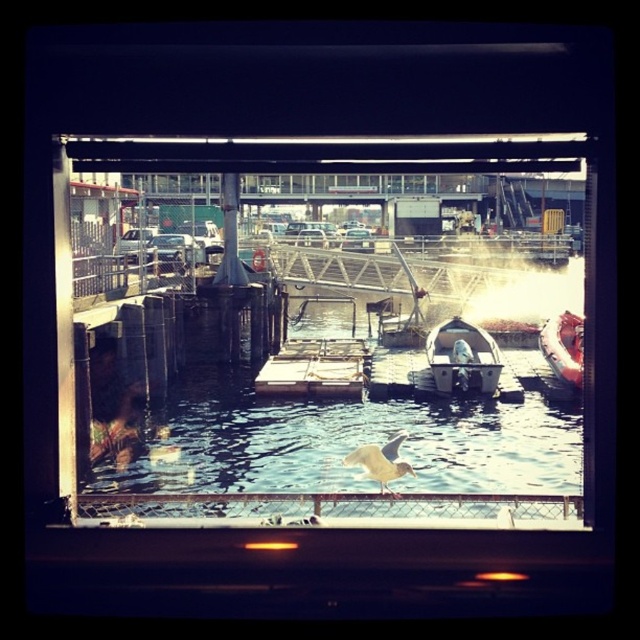
Between transparent glass window at center and white plastic boat at center, which one has less height?

white plastic boat at center is shorter.

Looking at this image, can you confirm if transparent glass window at center is bigger than white plastic boat at center?

Yes.

Does point (266, 358) come closer to viewer compared to point (499, 358)?

No, (266, 358) is behind (499, 358).

Identify the location of transparent glass window at center. The height and width of the screenshot is (640, 640). pyautogui.click(x=326, y=397).

Who is shorter, transparent glass window at center or white plastic dock at center?

white plastic dock at center

Can you confirm if transparent glass window at center is wider than white plastic dock at center?

Indeed, transparent glass window at center has a greater width compared to white plastic dock at center.

Who is more forward, (323, 234) or (289, 342)?

Point (289, 342) is in front.

Find the location of a particular element. The image size is (640, 640). transparent glass window at center is located at coordinates (326, 397).

Can you confirm if white plastic dock at center is wider than white plastic boat at center?

Indeed, white plastic dock at center has a greater width compared to white plastic boat at center.

Measure the distance between white plastic dock at center and camera.

white plastic dock at center and camera are 23.25 meters apart from each other.

Who is more forward, (308, 369) or (433, 355)?

Positioned in front is point (308, 369).

Locate an element on the screen. white plastic dock at center is located at coordinates (316, 369).